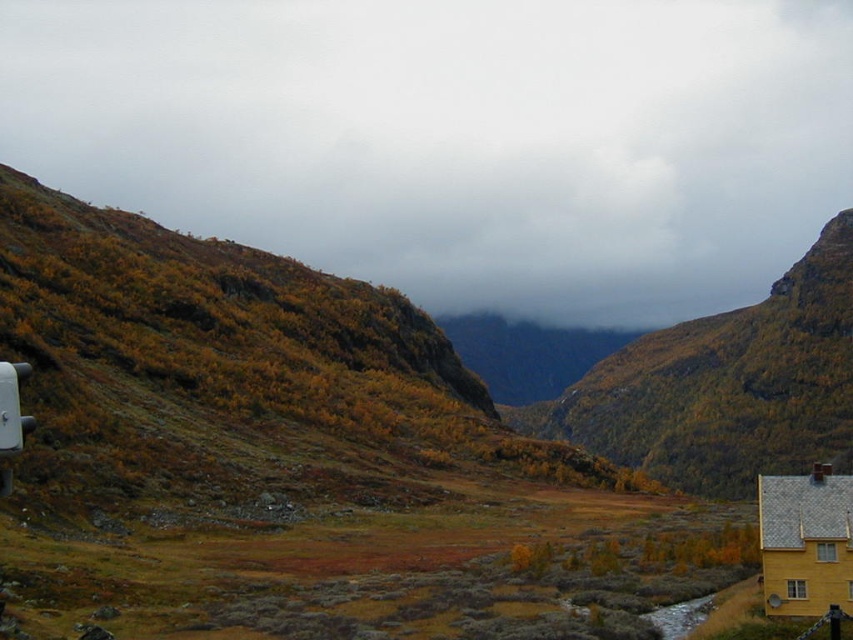
Who is shorter, yellow wooden house at lower right or white plastic recreational vehicle at left?

With less height is white plastic recreational vehicle at left.

Is yellow wooden house at lower right smaller than white plastic recreational vehicle at left?

No.

Where is `yellow wooden house at lower right`? yellow wooden house at lower right is located at coordinates (805, 541).

Does cloudy gray sky at upper center appear under yellow wooden house at lower right?

Incorrect, cloudy gray sky at upper center is not positioned below yellow wooden house at lower right.

Is cloudy gray sky at upper center positioned before yellow wooden house at lower right?

No, cloudy gray sky at upper center is behind yellow wooden house at lower right.

Is point (334, 16) positioned before point (776, 609)?

No.

Where is `cloudy gray sky at upper center`? cloudy gray sky at upper center is located at coordinates (456, 138).

Who is lower down, cloudy gray sky at upper center or white plastic recreational vehicle at left?

white plastic recreational vehicle at left is lower down.

What do you see at coordinates (456, 138) in the screenshot? I see `cloudy gray sky at upper center` at bounding box center [456, 138].

Describe the element at coordinates (456, 138) in the screenshot. The height and width of the screenshot is (640, 853). I see `cloudy gray sky at upper center` at that location.

Locate an element on the screen. The height and width of the screenshot is (640, 853). cloudy gray sky at upper center is located at coordinates (456, 138).